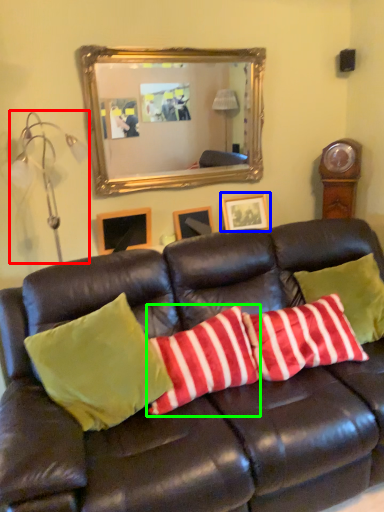
Question: Which object is the farthest from lamp (highlighted by a red box)? Choose among these: picture frame (highlighted by a blue box) or pillow (highlighted by a green box).

Choices:
 (A) picture frame
 (B) pillow

Answer: (B)